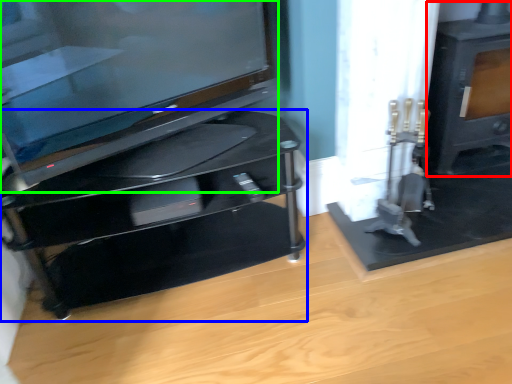
Question: Which object is the farthest from stove (highlighted by a red box)? Choose among these: furniture (highlighted by a blue box) or television (highlighted by a green box).

Choices:
 (A) furniture
 (B) television

Answer: (B)